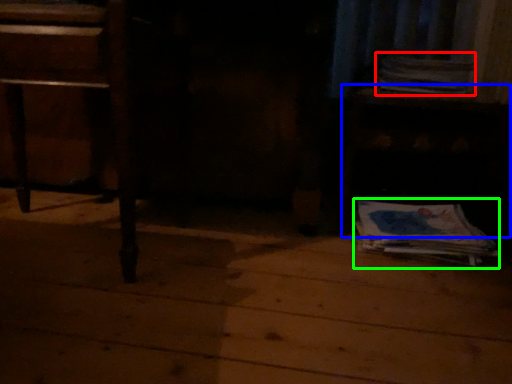
Question: Which is nearer to the paperback book (highlighted by a red box)? table (highlighted by a blue box) or paperback book (highlighted by a green box).

Choices:
 (A) table
 (B) paperback book

Answer: (A)